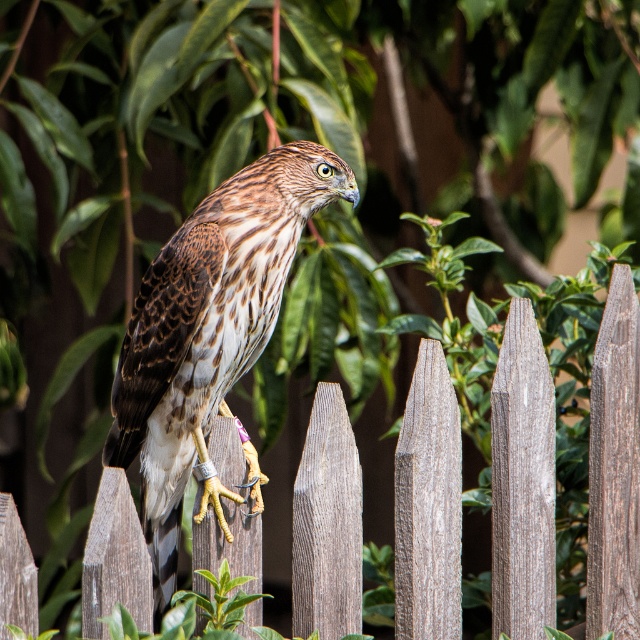
Is point (500, 618) positioned after point (193, 433)?

Yes, it is behind point (193, 433).

Which is below, wooden picket fence at center or brown speckled feathers at center?

wooden picket fence at center is below.

Is point (541, 474) farther from viewer compared to point (241, 225)?

Yes, point (541, 474) is behind point (241, 225).

Image resolution: width=640 pixels, height=640 pixels. Find the location of `wooden picket fence at center`. wooden picket fence at center is located at coordinates (522, 481).